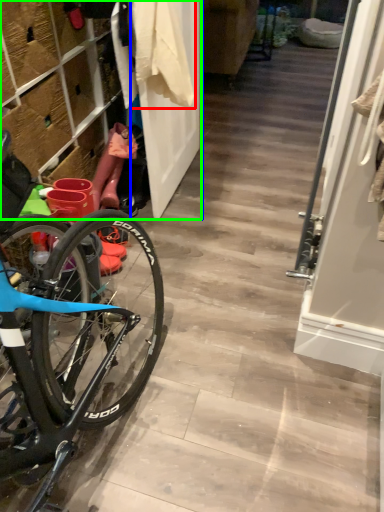
Question: Estimate the real-world distances between objects in this image. Which object is closer to clothing (highlighted by a red box), door (highlighted by a blue box) or closet (highlighted by a green box)?

Choices:
 (A) door
 (B) closet

Answer: (A)